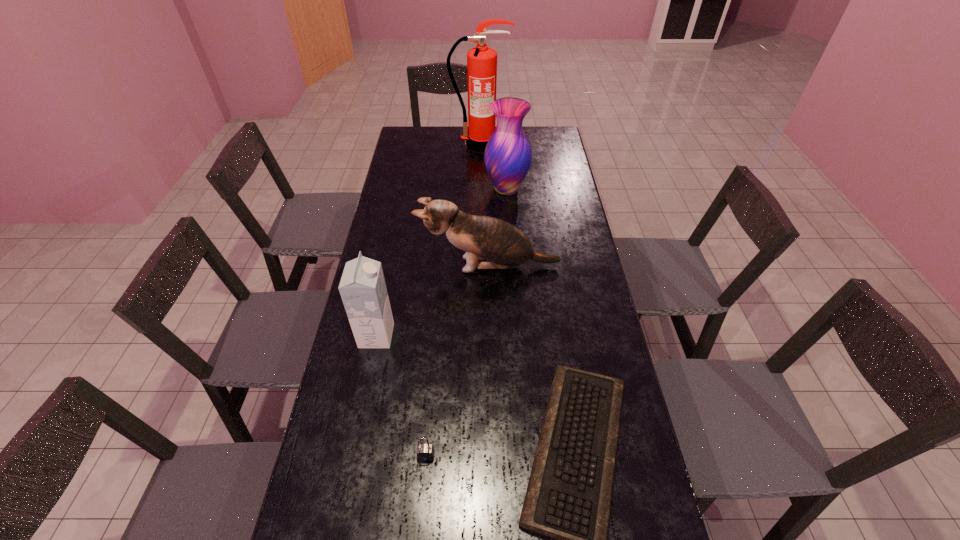
You are a GUI agent. You are given a task and a screenshot of the screen. Output one action in this format:
    pyautogui.click(x=<x>, y=<y>)
    Task: Click on the fire extinguisher
    The width and height of the screenshot is (960, 540).
    Given the screenshot: What is the action you would take?
    pyautogui.click(x=481, y=61)

Where is `the farthest object`? The height and width of the screenshot is (540, 960). the farthest object is located at coordinates (481, 61).

At what (x,y) coordinates should I click in order to perform the action: click on the fifth nearest object. Please return your answer as a coordinate pair (x, y). The height and width of the screenshot is (540, 960). Looking at the image, I should click on (508, 155).

At what (x,y) coordinates should I click in order to perform the action: click on carton. Please return your answer as a coordinate pair (x, y). The height and width of the screenshot is (540, 960). Looking at the image, I should click on (363, 290).

I want to click on the third nearest object, so click(x=363, y=290).

This screenshot has width=960, height=540. In order to click on the third farthest object in this screenshot , I will do `click(484, 238)`.

Image resolution: width=960 pixels, height=540 pixels. Identify the location of padlock. (425, 452).

The image size is (960, 540). Identify the location of free space located 0.130m with the nozzle aimed from the fire extinguisher. (480, 168).

What are the coordinates of `vacant position located on the back of the vase` in the screenshot? It's located at (504, 153).

Image resolution: width=960 pixels, height=540 pixels. What are the coordinates of `vacant space located on the front label of the fourth farthest object` in the screenshot? It's located at (482, 336).